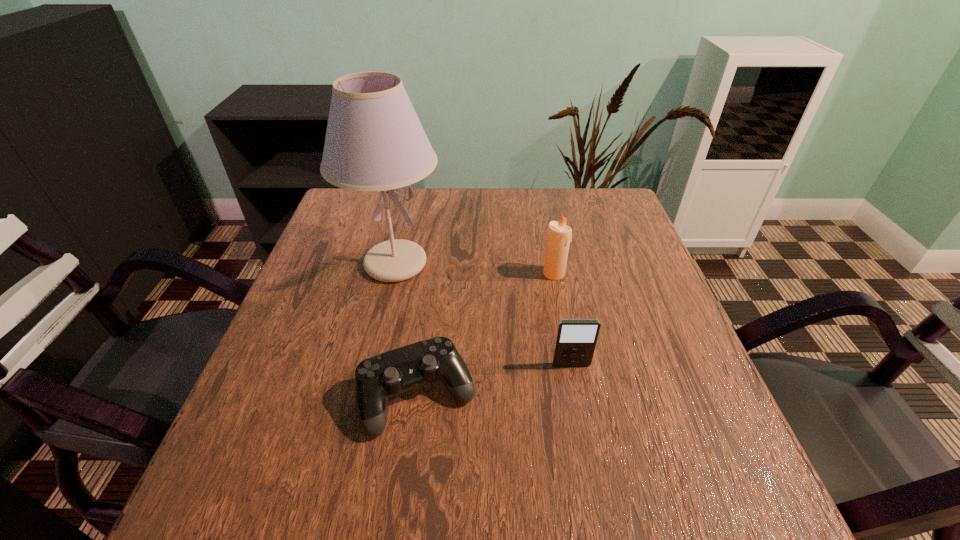
Find the location of `lampshade`. lampshade is located at coordinates (374, 141).

What are the coordinates of `candle` in the screenshot? It's located at (559, 236).

Locate an element on the screen. the third tallest object is located at coordinates (576, 339).

Image resolution: width=960 pixels, height=540 pixels. What are the coordinates of `the shortest object` in the screenshot? It's located at (377, 378).

Find the location of a particular element. The width and height of the screenshot is (960, 540). free space located on the front of the lampshade is located at coordinates (x=361, y=418).

The image size is (960, 540). In order to click on vacant space located 0.070m on the front of the third shortest object in this screenshot , I will do `click(560, 301)`.

This screenshot has height=540, width=960. What are the coordinates of `vacant area situated on the front-facing side of the second shortest object` in the screenshot? It's located at (x=579, y=408).

The image size is (960, 540). In order to click on vacant region located 0.240m on the right of the shortest object in this screenshot , I will do `click(605, 395)`.

This screenshot has width=960, height=540. Find the location of `object that is at the left edge`. object that is at the left edge is located at coordinates coord(374,141).

Where is `vacant region at the far edge of the desktop`? vacant region at the far edge of the desktop is located at coordinates (430, 194).